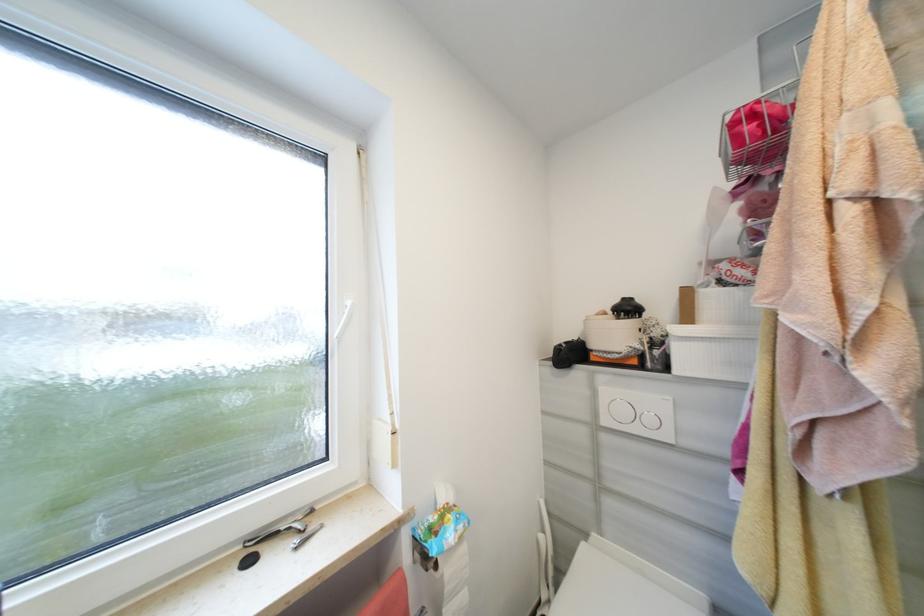
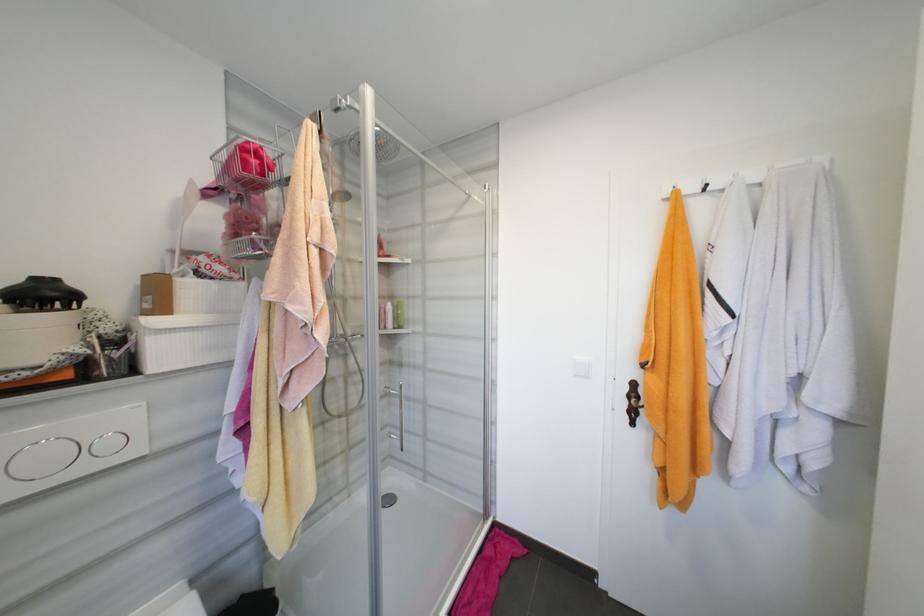
Question: The images are taken continuously from a first-person perspective. In which direction is your viewpoint rotating?

Choices:
 (A) Left
 (B) Right
 (C) Up
 (D) Down

Answer: (B)